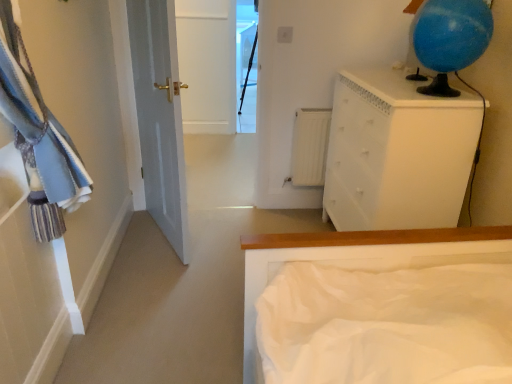
Question: In terms of width, does transparent glass window at center look wider or thinner when compared to white painted wood chest of drawers at upper right?

Choices:
 (A) wide
 (B) thin

Answer: (A)

Question: Looking at the image, does transparent glass window at center seem bigger or smaller compared to white painted wood chest of drawers at upper right?

Choices:
 (A) small
 (B) big

Answer: (A)

Question: Which of these objects is positioned closest to the blue fabric laundry at left?

Choices:
 (A) white matte bed at center
 (B) transparent glass window at center
 (C) white painted wood chest of drawers at upper right
 (D) white matte radiator at center

Answer: (A)

Question: Which object is positioned farthest from the white matte bed at center?

Choices:
 (A) blue fabric laundry at left
 (B) transparent glass window at center
 (C) white matte radiator at center
 (D) white painted wood chest of drawers at upper right

Answer: (B)